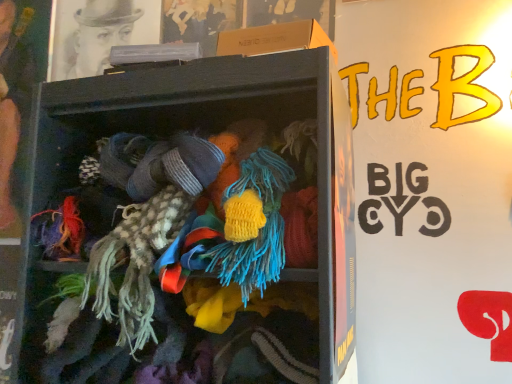
Question: Is smooth skin face at left taller or shorter than wooden shelf at center?

Choices:
 (A) short
 (B) tall

Answer: (B)

Question: Visually, is smooth skin face at left positioned to the left or to the right of wooden shelf at center?

Choices:
 (A) left
 (B) right

Answer: (A)

Question: In terms of width, does smooth skin face at left look wider or thinner when compared to wooden shelf at center?

Choices:
 (A) wide
 (B) thin

Answer: (B)

Question: Looking at the image, does wooden shelf at center seem bigger or smaller compared to smooth skin face at left?

Choices:
 (A) big
 (B) small

Answer: (A)

Question: Is point (259, 114) closer or farther from the camera than point (4, 203)?

Choices:
 (A) closer
 (B) farther

Answer: (A)

Question: From a real-world perspective, is wooden shelf at center physically located above or below smooth skin face at left?

Choices:
 (A) below
 (B) above

Answer: (A)

Question: Visually, is wooden shelf at center positioned to the left or to the right of smooth skin face at left?

Choices:
 (A) left
 (B) right

Answer: (B)